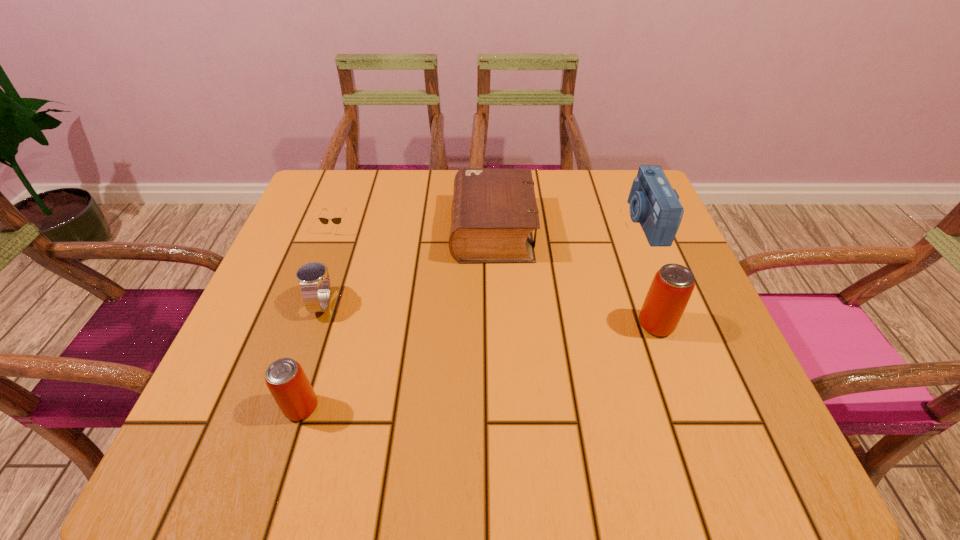
Identify the location of sunglasses located at the far edge. (337, 220).

The image size is (960, 540). Identify the location of object situated at the near edge. pyautogui.click(x=286, y=380).

Where is `beer can present at the left edge`? The width and height of the screenshot is (960, 540). beer can present at the left edge is located at coordinates (286, 380).

Where is `sunglasses that is at the left edge`? sunglasses that is at the left edge is located at coordinates (337, 220).

At what (x,y) coordinates should I click in order to perform the action: click on watch located in the left edge section of the desktop. Please return your answer as a coordinate pair (x, y). Looking at the image, I should click on (314, 280).

Where is `beer can present at the right edge`? The image size is (960, 540). beer can present at the right edge is located at coordinates (672, 286).

Image resolution: width=960 pixels, height=540 pixels. What are the coordinates of `camera that is at the right edge` in the screenshot? It's located at click(x=654, y=204).

Image resolution: width=960 pixels, height=540 pixels. I want to click on object that is at the far left corner, so click(337, 220).

Locate an element on the screen. The width and height of the screenshot is (960, 540). object located at the near left corner is located at coordinates (286, 380).

The image size is (960, 540). I want to click on object that is at the far right corner, so click(654, 204).